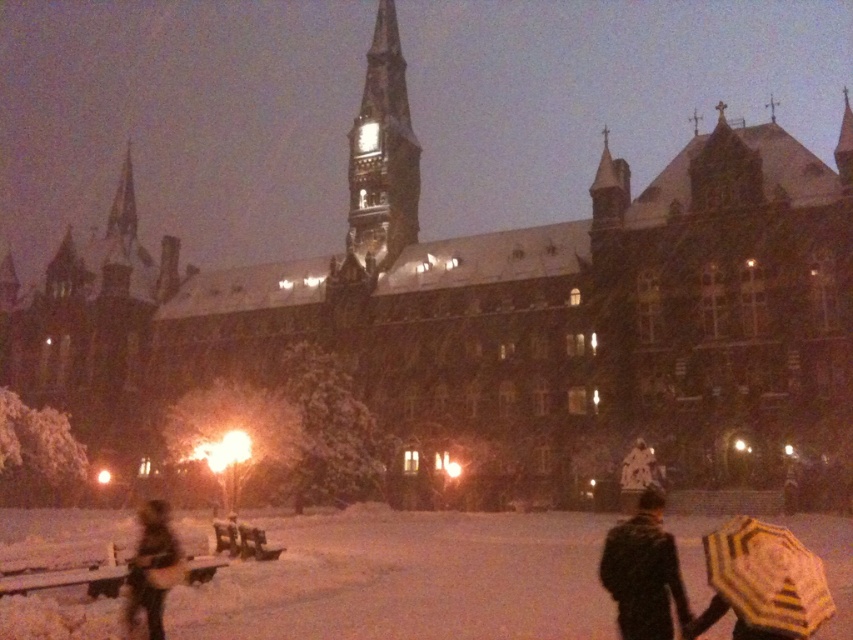
You are standing at the center of the image and want to place a small decorative snow globe on the ground. Which object, the yellow striped fabric umbrella at lower right or the dark brown leather jacket at lower left, would allow you to place the snow globe closer to the historic building?

The yellow striped fabric umbrella at lower right occupies less space than the dark brown leather jacket at lower left, so placing the snow globe near the yellow striped fabric umbrella at lower right would be closer to the historic building.